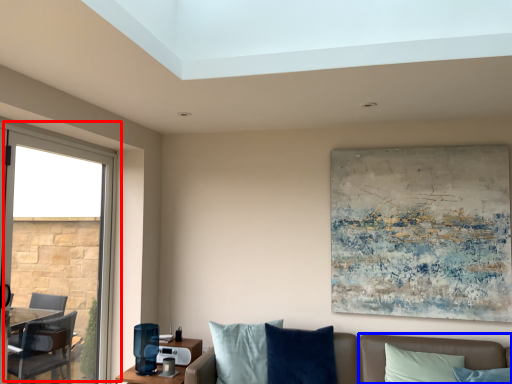
Question: Which of the following is the farthest to the observer, window (highlighted by a red box) or couch (highlighted by a blue box)?

Choices:
 (A) window
 (B) couch

Answer: (B)